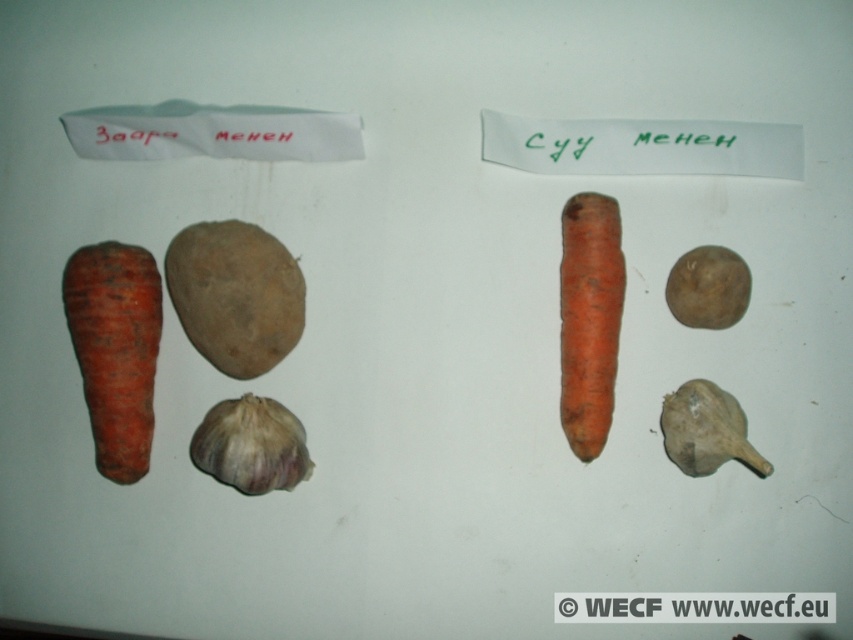
You are organizing vegetables in a display and need to place the grayish matte garlic at lower right and the brown matte potato at center right into boxes. The potato box requires items narrower than 10 cm. Can the garlic fit into the potato box based on their sizes?

The grayish matte garlic at lower right has a larger width than the brown matte potato at center right. Since the potato box requires items narrower than 10 cm, and the garlic is wider than the potato, it might exceed the width limit. Therefore, the garlic may not fit into the potato box.

You are organizing vegetables in a display and need to place a new item between the purple papery garlic at lower center and the grayish matte garlic at lower right. Based on their positions, which garlic should you place the new item closer to?

You should place the new item closer to the grayish matte garlic at lower right because the purple papery garlic at lower center is closer to you, so the grayish matte garlic at lower right is farther away and the space between them allows placing the new item nearer to the farther one.

You are organizing vegetables in a kitchen and see the brown rough potato at center and the grayish matte garlic at lower right. Which vegetable is located to the right of the other?

The grayish matte garlic at lower right is positioned to the right of the brown rough potato at center.